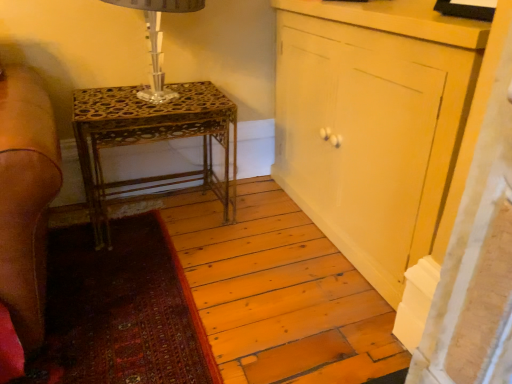
Locate an element on the screen. The image size is (512, 384). matte yellow cabinet at center is located at coordinates (373, 124).

From a real-world perspective, is clear glass table lamp at upper left positioned above or below gold metallic table at center?

clear glass table lamp at upper left is above gold metallic table at center.

Between clear glass table lamp at upper left and gold metallic table at center, which one has smaller width?

clear glass table lamp at upper left.

Which is nearer, (161, 95) or (202, 118)?

Point (161, 95).

Is clear glass table lamp at upper left aimed at gold metallic table at center?

No, clear glass table lamp at upper left is not aimed at gold metallic table at center.

Considering the sizes of objects clear glass table lamp at upper left and matte yellow cabinet at center in the image provided, who is taller, clear glass table lamp at upper left or matte yellow cabinet at center?

With more height is matte yellow cabinet at center.

Is clear glass table lamp at upper left in front of or behind matte yellow cabinet at center in the image?

Visually, clear glass table lamp at upper left is located behind matte yellow cabinet at center.

This screenshot has width=512, height=384. Identify the location of table lamp above the matte yellow cabinet at center (from a real-world perspective). (158, 40).

From a real-world perspective, is gold metallic table at center physically located above or below matte yellow cabinet at center?

gold metallic table at center is situated lower than matte yellow cabinet at center in the real world.

From the image's perspective, is gold metallic table at center positioned above or below matte yellow cabinet at center?

From the image's perspective, gold metallic table at center appears below matte yellow cabinet at center.

Could you tell me if gold metallic table at center is facing matte yellow cabinet at center?

No, gold metallic table at center is not aimed at matte yellow cabinet at center.

Is gold metallic table at center touching matte yellow cabinet at center?

gold metallic table at center is not next to matte yellow cabinet at center, and they're not touching.

You are a GUI agent. You are given a task and a screenshot of the screen. Output one action in this format:
    pyautogui.click(x=<x>, y=<y>)
    Task: Click on the cabinetry above the gold metallic table at center (from a real-world perspective)
    
    Given the screenshot: What is the action you would take?
    pyautogui.click(x=373, y=124)

Can you confirm if matte yellow cabinet at center is shorter than gold metallic table at center?

Incorrect, the height of matte yellow cabinet at center does not fall short of that of gold metallic table at center.

Is matte yellow cabinet at center not close to gold metallic table at center?

No, matte yellow cabinet at center is not far away from gold metallic table at center.

Who is smaller, matte yellow cabinet at center or gold metallic table at center?

gold metallic table at center is smaller.

Based on their positions, is matte yellow cabinet at center located to the left or right of clear glass table lamp at upper left?

In the image, matte yellow cabinet at center appears on the right side of clear glass table lamp at upper left.

From a real-world perspective, which object stands above the other?

clear glass table lamp at upper left.

Is matte yellow cabinet at center next to clear glass table lamp at upper left?

No, matte yellow cabinet at center is not next to clear glass table lamp at upper left.

From the image's perspective, does gold metallic table at center appear lower than clear glass table lamp at upper left?

Correct, gold metallic table at center appears lower than clear glass table lamp at upper left in the image.

Looking at this image, is clear glass table lamp at upper left inside gold metallic table at center?

Actually, clear glass table lamp at upper left is outside gold metallic table at center.

Considering the positions of points (205, 92) and (146, 11), is point (205, 92) closer to camera compared to point (146, 11)?

No, it is behind (146, 11).

Locate an element on the screen. This screenshot has height=384, width=512. nightstand behind the clear glass table lamp at upper left is located at coordinates (152, 140).

Where is `cabinetry below the clear glass table lamp at upper left (from the image's perspective)`? The height and width of the screenshot is (384, 512). cabinetry below the clear glass table lamp at upper left (from the image's perspective) is located at coordinates (373, 124).

Considering their positions, is clear glass table lamp at upper left positioned further to gold metallic table at center than matte yellow cabinet at center?

matte yellow cabinet at center is positioned further to the anchor gold metallic table at center.

Considering their positions, is gold metallic table at center positioned further to matte yellow cabinet at center than clear glass table lamp at upper left?

clear glass table lamp at upper left is positioned further to the anchor matte yellow cabinet at center.

Which object lies nearer to the anchor point gold metallic table at center, matte yellow cabinet at center or clear glass table lamp at upper left?

Among the two, clear glass table lamp at upper left is located nearer to gold metallic table at center.

Looking at the image, which one is located further to clear glass table lamp at upper left, matte yellow cabinet at center or gold metallic table at center?

matte yellow cabinet at center is further to clear glass table lamp at upper left.

In the scene shown: Based on their spatial positions, is clear glass table lamp at upper left or gold metallic table at center closer to matte yellow cabinet at center?

gold metallic table at center is closer to matte yellow cabinet at center.

Considering their positions, is gold metallic table at center positioned further to clear glass table lamp at upper left than matte yellow cabinet at center?

The object further to clear glass table lamp at upper left is matte yellow cabinet at center.

Where is `table lamp between gold metallic table at center and matte yellow cabinet at center from left to right`? This screenshot has height=384, width=512. table lamp between gold metallic table at center and matte yellow cabinet at center from left to right is located at coordinates point(158,40).